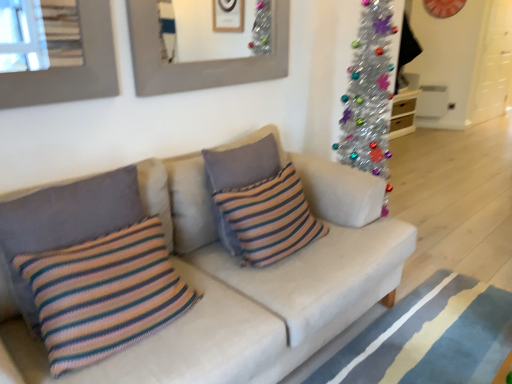
The height and width of the screenshot is (384, 512). Find the location of `vacant space in matte gray picture frame at upper center (from a real-world perspective)`. vacant space in matte gray picture frame at upper center (from a real-world perspective) is located at coordinates (213, 122).